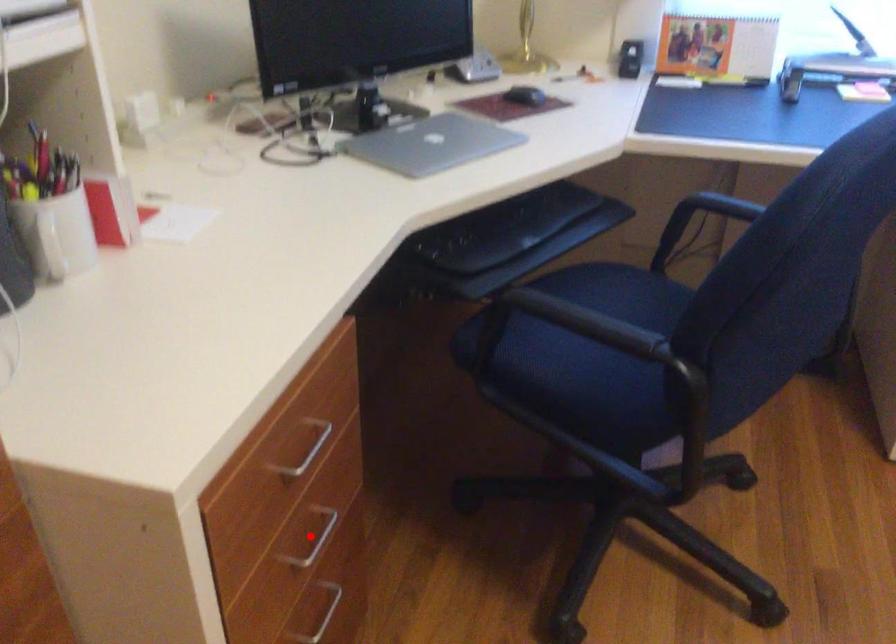
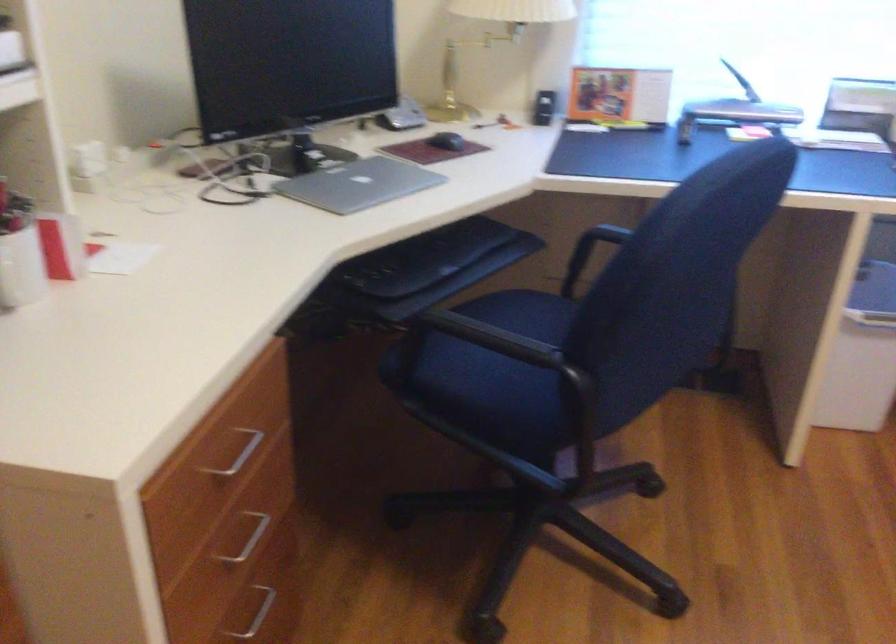
The point at the highlighted location is marked in the first image. Where is the corresponding point in the second image?

(247, 538)